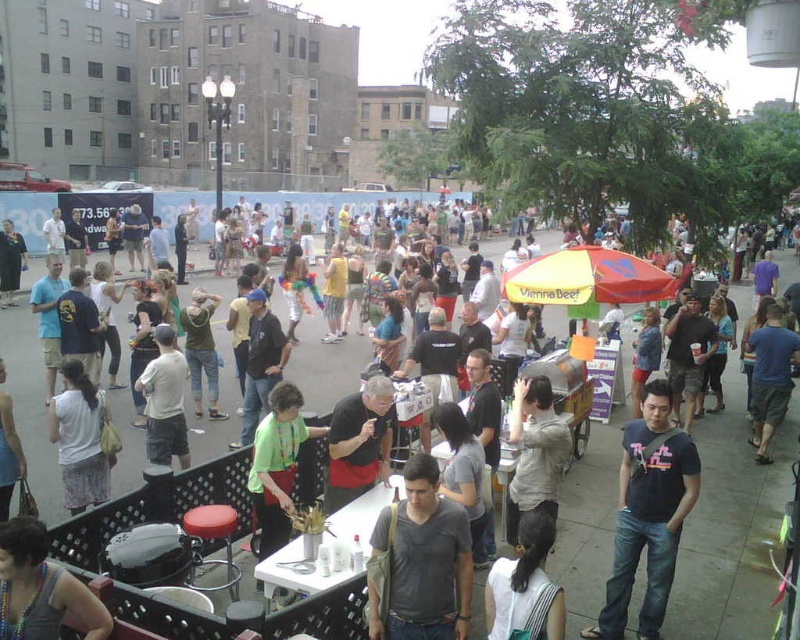
Is dark blue t-shirt at center above dark gray cotton shirt at center?

Actually, dark blue t-shirt at center is below dark gray cotton shirt at center.

Measure the distance between point (x=658, y=508) and camera.

Point (x=658, y=508) is 29.61 feet from camera.

Identify the location of dark blue t-shirt at center. (648, 513).